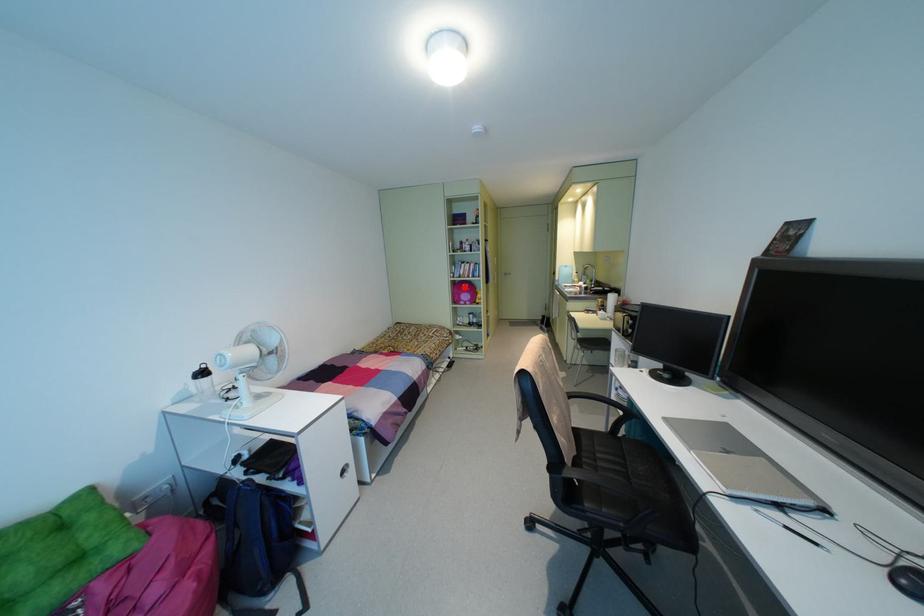
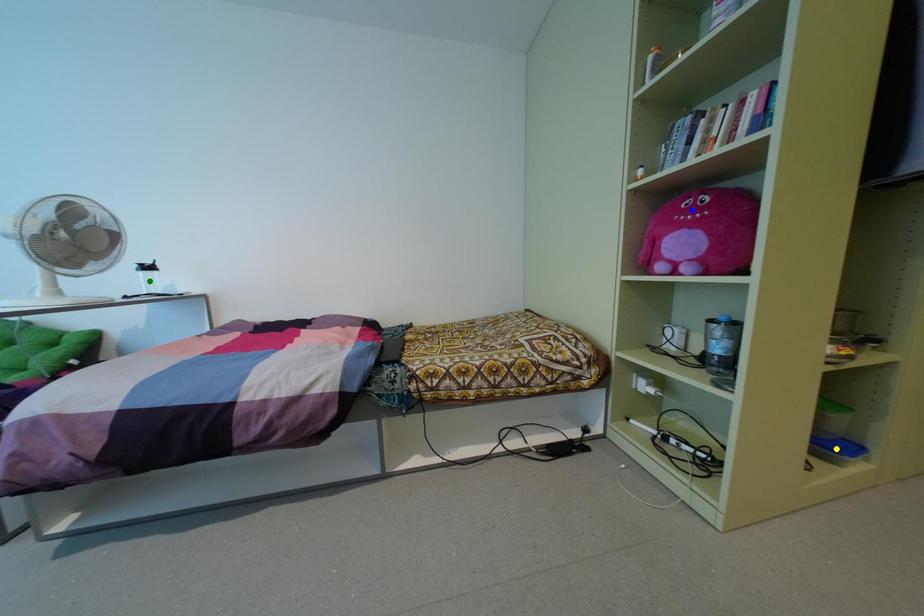
Question: I am providing you with two images of the same scene from different viewpoints. A red point is marked on the first image. You are given multiple points on the second image. Which point in image 2 is actually the same real-world point as the red point in image 1?

Choices:
 (A) green point
 (B) blue point
 (C) yellow point

Answer: (B)